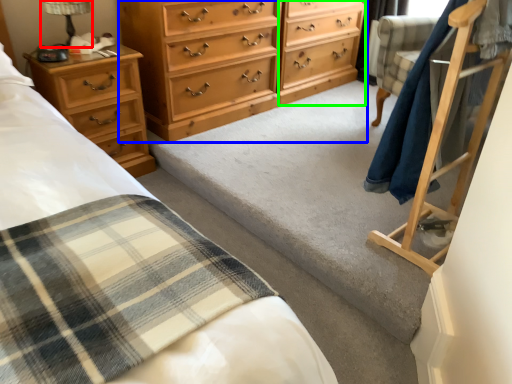
Question: Estimate the real-world distances between objects in this image. Which object is farther from table lamp (highlighted by a red box), chest of drawers (highlighted by a blue box) or file cabinet (highlighted by a green box)?

Choices:
 (A) chest of drawers
 (B) file cabinet

Answer: (B)